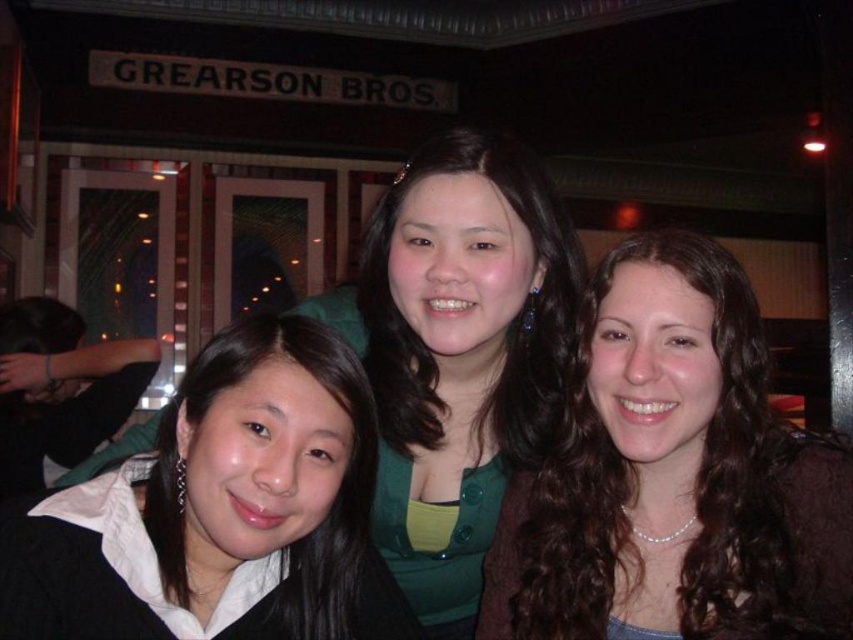
Question: Is brown curly hair at center in front of green matte shirt at center?

Choices:
 (A) no
 (B) yes

Answer: (B)

Question: Does matte black jacket at lower left have a greater width compared to green matte shirt at center?

Choices:
 (A) no
 (B) yes

Answer: (B)

Question: Considering the real-world distances, which object is farthest from the green matte shirt at center?

Choices:
 (A) matte black jacket at lower left
 (B) brown curly hair at center

Answer: (A)

Question: Does brown curly hair at center lie behind matte black jacket at lower left?

Choices:
 (A) yes
 (B) no

Answer: (A)

Question: Which object is closer to the camera taking this photo?

Choices:
 (A) green matte shirt at center
 (B) brown curly hair at center

Answer: (B)

Question: Which of the following is the closest to the observer?

Choices:
 (A) (751, 451)
 (B) (438, 337)

Answer: (A)